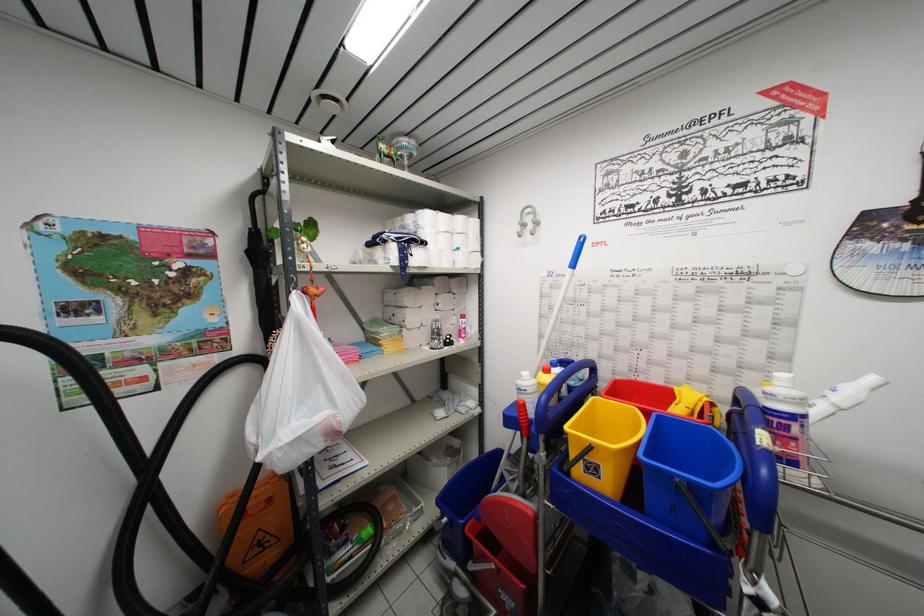
What do you see at coordinates (525, 504) in the screenshot? The width and height of the screenshot is (924, 616). I see `a red bucket handle` at bounding box center [525, 504].